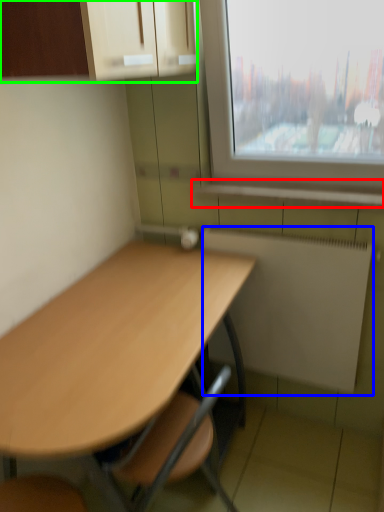
Question: Based on their relative distances, which object is nearer to window sill (highlighted by a red box)? Choose from radiator (highlighted by a blue box) and cabinetry (highlighted by a green box).

Choices:
 (A) radiator
 (B) cabinetry

Answer: (A)